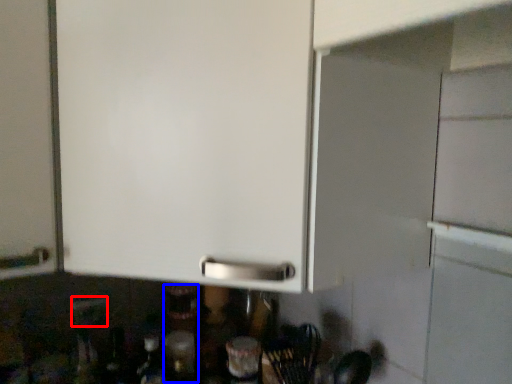
Question: Which object is further to the camera taking this photo, electric outlet (highlighted by a red box) or bottle (highlighted by a blue box)?

Choices:
 (A) electric outlet
 (B) bottle

Answer: (B)